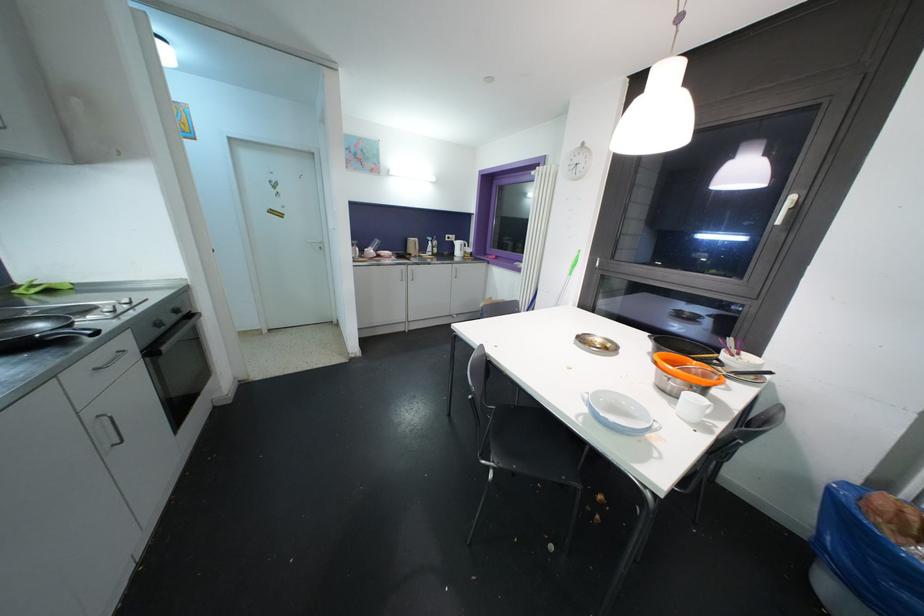
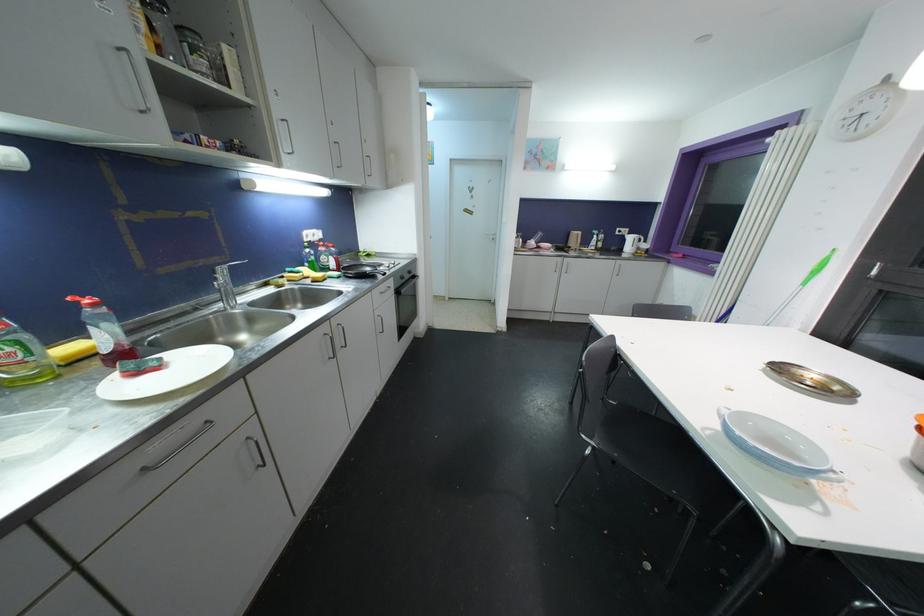
In the second image, find the point that corresponds to (x=43, y=329) in the first image.

(371, 272)